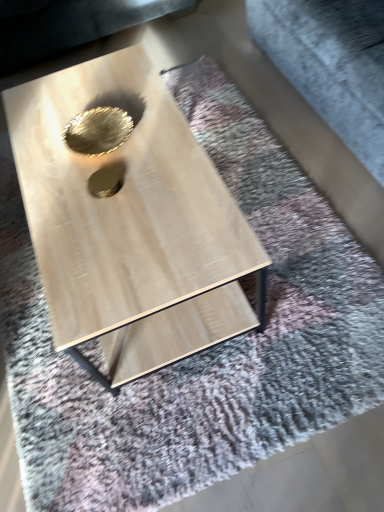
Where is `vacant space behind gold metallic hole at center, which appears as the 2th hole when ordered from the bottom`? Image resolution: width=384 pixels, height=512 pixels. vacant space behind gold metallic hole at center, which appears as the 2th hole when ordered from the bottom is located at coordinates 96,100.